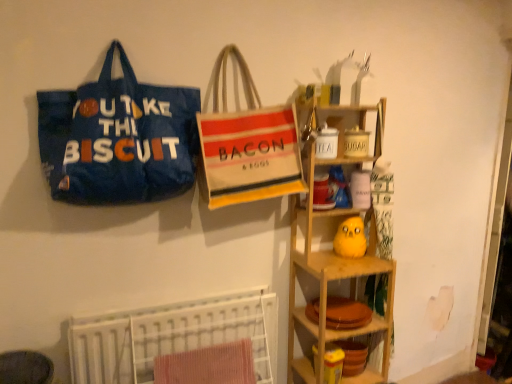
Describe the element at coordinates (246, 143) in the screenshot. I see `beige canvas tote bag at center, positioned as the second handbag in left-to-right order` at that location.

Image resolution: width=512 pixels, height=384 pixels. In order to click on red textured towel at lower center in this screenshot , I will do `click(208, 365)`.

You are a GUI agent. You are given a task and a screenshot of the screen. Output one action in this format:
    pyautogui.click(x=<x>, y=<y>)
    Task: Click on the blue fabric tote bag at left, the 2th handbag viewed from the right
    The height and width of the screenshot is (384, 512).
    Given the screenshot: What is the action you would take?
    pyautogui.click(x=118, y=139)

What do you see at coordinates (352, 329) in the screenshot? I see `wooden plate at lower center, the first shelf when ordered from bottom to top` at bounding box center [352, 329].

This screenshot has width=512, height=384. What do you see at coordinates (330, 281) in the screenshot?
I see `wooden shelf at right, which is the first shelf from top to bottom` at bounding box center [330, 281].

At what (x,y) coordinates should I click in order to perform the action: click on beige canvas tote bag at center, positioned as the second handbag in left-to-right order. Please return your answer as a coordinate pair (x, y). The height and width of the screenshot is (384, 512). Looking at the image, I should click on (246, 143).

Who is bigger, white textured bed at lower left or wooden plate at lower center, the 2th shelf in the top-to-bottom sequence?

white textured bed at lower left.

Considering the relative positions of white textured bed at lower left and wooden plate at lower center, the first shelf when ordered from bottom to top, in the image provided, is white textured bed at lower left to the left of wooden plate at lower center, the first shelf when ordered from bottom to top, from the viewer's perspective?

Correct, you'll find white textured bed at lower left to the left of wooden plate at lower center, the first shelf when ordered from bottom to top.

Is white textured bed at lower left oriented away from wooden plate at lower center, the 2th shelf in the top-to-bottom sequence?

white textured bed at lower left does not have its back to wooden plate at lower center, the 2th shelf in the top-to-bottom sequence.

Is white textured bed at lower left not close to wooden plate at lower center, the first shelf when ordered from bottom to top?

They are positioned close to each other.

Between blue fabric tote bag at left, the 2th handbag viewed from the right, and white textured bed at lower left, which one is positioned behind?

Positioned behind is white textured bed at lower left.

The width and height of the screenshot is (512, 384). I want to click on bed that is below the blue fabric tote bag at left, the 2th handbag viewed from the right (from the image's perspective), so click(170, 336).

Who is taller, blue fabric tote bag at left, the 2th handbag viewed from the right, or white textured bed at lower left?

blue fabric tote bag at left, the 2th handbag viewed from the right, is taller.

Considering the relative positions of blue fabric tote bag at left, placed as the 1th handbag when sorted from left to right, and white textured bed at lower left in the image provided, is blue fabric tote bag at left, placed as the 1th handbag when sorted from left to right, to the left of white textured bed at lower left from the viewer's perspective?

Yes.

From the image's perspective, is blue fabric tote bag at left, the 2th handbag viewed from the right, beneath wooden shelf at right, which is the first shelf from top to bottom?

No, from the image's perspective, blue fabric tote bag at left, the 2th handbag viewed from the right, is not beneath wooden shelf at right, which is the first shelf from top to bottom.

Which is in front, blue fabric tote bag at left, the 2th handbag viewed from the right, or wooden shelf at right, which is the first shelf from top to bottom?

blue fabric tote bag at left, the 2th handbag viewed from the right, is in front.

Considering the points (116, 112) and (387, 373), which point is in front, point (116, 112) or point (387, 373)?

Positioned in front is point (116, 112).

Can you confirm if wooden plate at lower center, the first shelf when ordered from bottom to top, is bigger than white textured bed at lower left?

No, wooden plate at lower center, the first shelf when ordered from bottom to top, is not bigger than white textured bed at lower left.

Is wooden plate at lower center, the first shelf when ordered from bottom to top, next to white textured bed at lower left?

wooden plate at lower center, the first shelf when ordered from bottom to top, and white textured bed at lower left are clearly separated.

What's the angular difference between wooden plate at lower center, the first shelf when ordered from bottom to top, and white textured bed at lower left's facing directions?

wooden plate at lower center, the first shelf when ordered from bottom to top, and white textured bed at lower left are facing 2.08 degrees away from each other.

In terms of width, does wooden shelf at right, which is the first shelf from top to bottom, look wider or thinner when compared to white textured bed at lower left?

wooden shelf at right, which is the first shelf from top to bottom, is wider than white textured bed at lower left.

Could white textured bed at lower left be considered to be inside wooden shelf at right, which is the first shelf from top to bottom?

No, white textured bed at lower left is not inside wooden shelf at right, which is the first shelf from top to bottom.

This screenshot has height=384, width=512. In order to click on the 1st shelf to the right when counting from the white textured bed at lower left in this screenshot , I will do point(330,281).

Are beige canvas tote bag at center, positioned as the second handbag in left-to-right order, and white textured bed at lower left beside each other?

No, beige canvas tote bag at center, positioned as the second handbag in left-to-right order, is not beside white textured bed at lower left.

Considering the relative positions of beige canvas tote bag at center, positioned as the second handbag in left-to-right order, and white textured bed at lower left in the image provided, is beige canvas tote bag at center, positioned as the second handbag in left-to-right order, to the left of white textured bed at lower left from the viewer's perspective?

No, beige canvas tote bag at center, positioned as the second handbag in left-to-right order, is not to the left of white textured bed at lower left.

Which of these two, beige canvas tote bag at center, positioned as the second handbag in left-to-right order, or white textured bed at lower left, is thinner?

Thinner between the two is white textured bed at lower left.

Does point (224, 156) lie behind point (75, 323)?

No, it is not.

Which is correct: beige canvas tote bag at center, acting as the 1th handbag starting from the right, is inside wooden plate at lower center, the first shelf when ordered from bottom to top, or outside of it?

beige canvas tote bag at center, acting as the 1th handbag starting from the right, cannot be found inside wooden plate at lower center, the first shelf when ordered from bottom to top.

Could you tell me if beige canvas tote bag at center, acting as the 1th handbag starting from the right, is turned towards wooden plate at lower center, the first shelf when ordered from bottom to top?

No, beige canvas tote bag at center, acting as the 1th handbag starting from the right, is not turned towards wooden plate at lower center, the first shelf when ordered from bottom to top.

Is beige canvas tote bag at center, positioned as the second handbag in left-to-right order, behind wooden plate at lower center, the first shelf when ordered from bottom to top?

No, the depth of beige canvas tote bag at center, positioned as the second handbag in left-to-right order, is less than that of wooden plate at lower center, the first shelf when ordered from bottom to top.

Considering the relative sizes of beige canvas tote bag at center, positioned as the second handbag in left-to-right order, and wooden plate at lower center, the first shelf when ordered from bottom to top, in the image provided, is beige canvas tote bag at center, positioned as the second handbag in left-to-right order, bigger than wooden plate at lower center, the first shelf when ordered from bottom to top,?

Correct, beige canvas tote bag at center, positioned as the second handbag in left-to-right order, is larger in size than wooden plate at lower center, the first shelf when ordered from bottom to top.

There is a white textured bed at lower left. Where is `the 1st shelf above it (from the image's perspective)`? The height and width of the screenshot is (384, 512). the 1st shelf above it (from the image's perspective) is located at coordinates point(352,329).

Identify the location of handbag that is the 2nd object above the white textured bed at lower left (from a real-world perspective). The image size is (512, 384). (118, 139).

When comparing their distances from blue fabric tote bag at left, the 2th handbag viewed from the right, does white textured bed at lower left or red textured towel at lower center seem closer?

Based on the image, white textured bed at lower left appears to be nearer to blue fabric tote bag at left, the 2th handbag viewed from the right.

When comparing their distances from wooden shelf at right, arranged as the 2th shelf when ordered from the bottom, does blue fabric tote bag at left, the 2th handbag viewed from the right, or wooden plate at lower center, the 2th shelf in the top-to-bottom sequence, seem closer?

The object closer to wooden shelf at right, arranged as the 2th shelf when ordered from the bottom, is wooden plate at lower center, the 2th shelf in the top-to-bottom sequence.

From the image, which object appears to be nearer to white textured bed at lower left, beige canvas tote bag at center, positioned as the second handbag in left-to-right order, or blue fabric tote bag at left, the 2th handbag viewed from the right?

The object closer to white textured bed at lower left is beige canvas tote bag at center, positioned as the second handbag in left-to-right order.

Estimate the real-world distances between objects in this image. Which object is closer to blue fabric tote bag at left, the 2th handbag viewed from the right, white textured bed at lower left or wooden plate at lower center, the 2th shelf in the top-to-bottom sequence?

The object closer to blue fabric tote bag at left, the 2th handbag viewed from the right, is white textured bed at lower left.

Which object lies further to the anchor point beige canvas tote bag at center, positioned as the second handbag in left-to-right order, blue fabric tote bag at left, the 2th handbag viewed from the right, or wooden shelf at right, which is the first shelf from top to bottom?

wooden shelf at right, which is the first shelf from top to bottom, lies further to beige canvas tote bag at center, positioned as the second handbag in left-to-right order, than the other object.

From the image, which object appears to be nearer to wooden plate at lower center, the 2th shelf in the top-to-bottom sequence, wooden shelf at right, arranged as the 2th shelf when ordered from the bottom, or beige canvas tote bag at center, acting as the 1th handbag starting from the right?

wooden shelf at right, arranged as the 2th shelf when ordered from the bottom, lies closer to wooden plate at lower center, the 2th shelf in the top-to-bottom sequence, than the other object.

Estimate the real-world distances between objects in this image. Which object is closer to wooden shelf at right, arranged as the 2th shelf when ordered from the bottom, wooden plate at lower center, the first shelf when ordered from bottom to top, or red textured towel at lower center?

wooden plate at lower center, the first shelf when ordered from bottom to top, lies closer to wooden shelf at right, arranged as the 2th shelf when ordered from the bottom, than the other object.

Considering their positions, is wooden plate at lower center, the first shelf when ordered from bottom to top, positioned further to white textured bed at lower left than wooden shelf at right, arranged as the 2th shelf when ordered from the bottom?

wooden shelf at right, arranged as the 2th shelf when ordered from the bottom, is positioned further to the anchor white textured bed at lower left.

Locate an element on the screen. Image resolution: width=512 pixels, height=384 pixels. beach towel situated between white textured bed at lower left and wooden plate at lower center, the 2th shelf in the top-to-bottom sequence, from left to right is located at coordinates (208, 365).

Identify the location of handbag between beige canvas tote bag at center, positioned as the second handbag in left-to-right order, and white textured bed at lower left, in the vertical direction. The width and height of the screenshot is (512, 384). (118, 139).

At what (x,y) coordinates should I click in order to perform the action: click on bed that lies between beige canvas tote bag at center, positioned as the second handbag in left-to-right order, and red textured towel at lower center from top to bottom. Please return your answer as a coordinate pair (x, y). Image resolution: width=512 pixels, height=384 pixels. Looking at the image, I should click on (170, 336).

Where is `shelf situated between white textured bed at lower left and wooden plate at lower center, the 2th shelf in the top-to-bottom sequence, from left to right`? shelf situated between white textured bed at lower left and wooden plate at lower center, the 2th shelf in the top-to-bottom sequence, from left to right is located at coordinates (330, 281).